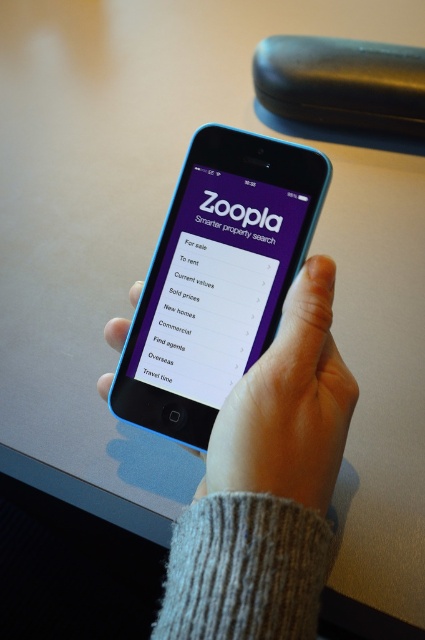
Question: Is gray knitted sweater at center further to camera compared to smooth skin hand at center?

Choices:
 (A) yes
 (B) no

Answer: (B)

Question: Is blue plastic smartphone at center further to camera compared to smooth skin hand at center?

Choices:
 (A) no
 (B) yes

Answer: (B)

Question: Which point appears closest to the camera in this image?

Choices:
 (A) (328, 492)
 (B) (215, 268)

Answer: (A)

Question: Which object is positioned closest to the gray knitted sweater at center?

Choices:
 (A) blue plastic smartphone at center
 (B) purple matte screen at center

Answer: (A)

Question: Does smooth skin hand at center appear on the left side of purple matte screen at center?

Choices:
 (A) yes
 (B) no

Answer: (B)

Question: Which point is closer to the camera?

Choices:
 (A) (311, 506)
 (B) (237, 413)
 (C) (238, 234)
 (D) (209, 432)

Answer: (A)